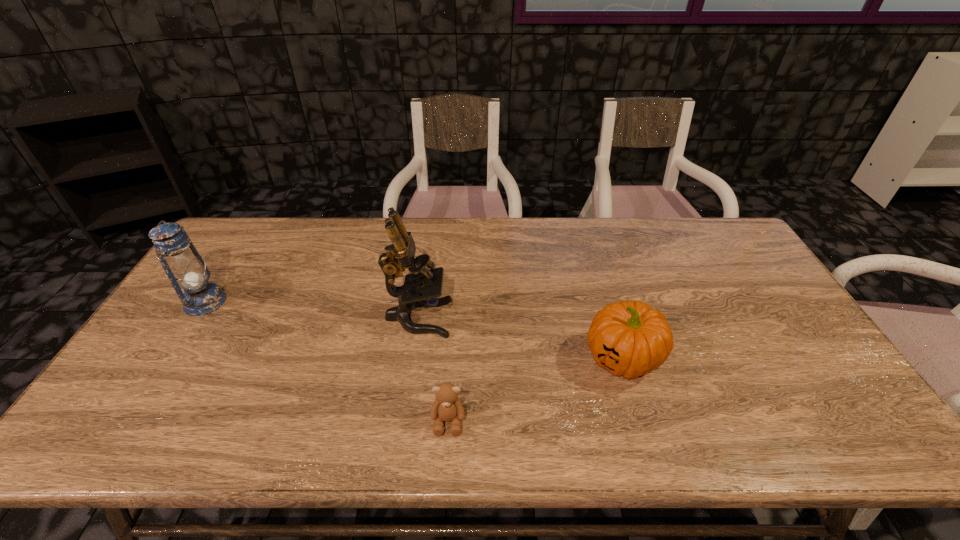
What are the coordinates of `the tallest object` in the screenshot? It's located at (421, 287).

Where is `the second tallest object`? The width and height of the screenshot is (960, 540). the second tallest object is located at coordinates (186, 270).

Where is `the leftmost object`? The image size is (960, 540). the leftmost object is located at coordinates (186, 270).

Locate an element on the screen. the second shortest object is located at coordinates (630, 339).

Where is `the rightmost object`? This screenshot has width=960, height=540. the rightmost object is located at coordinates (630, 339).

Where is `the shortest object`? The image size is (960, 540). the shortest object is located at coordinates (447, 407).

Identify the location of the nearest object. The width and height of the screenshot is (960, 540). click(x=447, y=407).

Where is `free space located at the eyepieces of the tallest object`? The width and height of the screenshot is (960, 540). free space located at the eyepieces of the tallest object is located at coordinates (503, 318).

Locate an element on the screen. The width and height of the screenshot is (960, 540). vacant space situated 0.080m on the front-facing side of the second tallest object is located at coordinates pos(252,302).

Locate an element on the screen. This screenshot has width=960, height=540. vacant space situated 0.180m on the surface of the pumpkin is located at coordinates (515, 358).